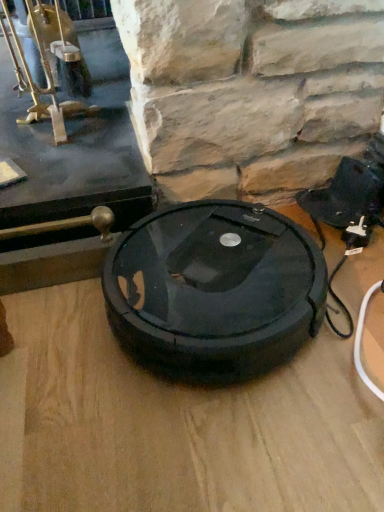
Where is `empty space that is ontop of black rubber robot vacuum cleaner at center (from a real-world perspective)`? The height and width of the screenshot is (512, 384). empty space that is ontop of black rubber robot vacuum cleaner at center (from a real-world perspective) is located at coordinates tap(201, 272).